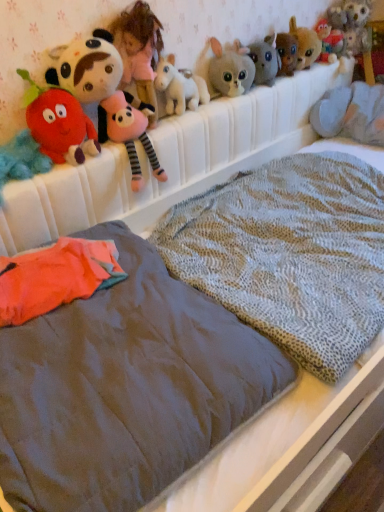
Question: Is textured gray blanket at center wider than fluffy plush strawberry at left, the sixth toy when ordered from right to left?

Choices:
 (A) yes
 (B) no

Answer: (A)

Question: Is fluffy plush strawberry at left, the sixth toy when ordered from right to left, completely or partially inside textured gray blanket at center?

Choices:
 (A) no
 (B) yes

Answer: (A)

Question: Is textured gray blanket at center not near fluffy plush strawberry at left, the sixth toy when ordered from right to left?

Choices:
 (A) yes
 (B) no

Answer: (B)

Question: Considering the relative sizes of textured gray blanket at center and fluffy plush strawberry at left, acting as the 2th toy starting from the left, in the image provided, is textured gray blanket at center thinner than fluffy plush strawberry at left, acting as the 2th toy starting from the left,?

Choices:
 (A) no
 (B) yes

Answer: (A)

Question: Can you confirm if textured gray blanket at center is smaller than fluffy plush strawberry at left, acting as the 2th toy starting from the left?

Choices:
 (A) no
 (B) yes

Answer: (A)

Question: In the image, is smooth gray mattress at center on the left side or the right side of gray plush toy at upper right?

Choices:
 (A) left
 (B) right

Answer: (A)

Question: Which is correct: smooth gray mattress at center is inside gray plush toy at upper right, or outside of it?

Choices:
 (A) inside
 (B) outside

Answer: (B)

Question: Is smooth gray mattress at center bigger or smaller than gray plush toy at upper right?

Choices:
 (A) small
 (B) big

Answer: (B)

Question: Does point (89, 504) appear closer or farther from the camera than point (375, 141)?

Choices:
 (A) closer
 (B) farther

Answer: (A)

Question: Is fluffy plush strawberry at left, the sixth toy when ordered from right to left, spatially inside textured gray blanket at center, or outside of it?

Choices:
 (A) inside
 (B) outside

Answer: (B)

Question: From a real-world perspective, is fluffy plush strawberry at left, acting as the 2th toy starting from the left, positioned above or below textured gray blanket at center?

Choices:
 (A) below
 (B) above

Answer: (B)

Question: Considering their positions, is fluffy plush strawberry at left, acting as the 2th toy starting from the left, located in front of or behind textured gray blanket at center?

Choices:
 (A) front
 (B) behind

Answer: (B)

Question: Considering the relative positions of fluffy plush strawberry at left, acting as the 2th toy starting from the left, and textured gray blanket at center in the image provided, is fluffy plush strawberry at left, acting as the 2th toy starting from the left, to the left or to the right of textured gray blanket at center?

Choices:
 (A) right
 (B) left

Answer: (B)

Question: From a real-world perspective, is fluffy plush strawberry at left, acting as the 2th toy starting from the left, physically located above or below fluffy red plush toy at left, positioned as the 1th toy in left-to-right order?

Choices:
 (A) above
 (B) below

Answer: (A)

Question: Is point pos(74,98) closer or farther from the camera than point pos(23,157)?

Choices:
 (A) closer
 (B) farther

Answer: (B)